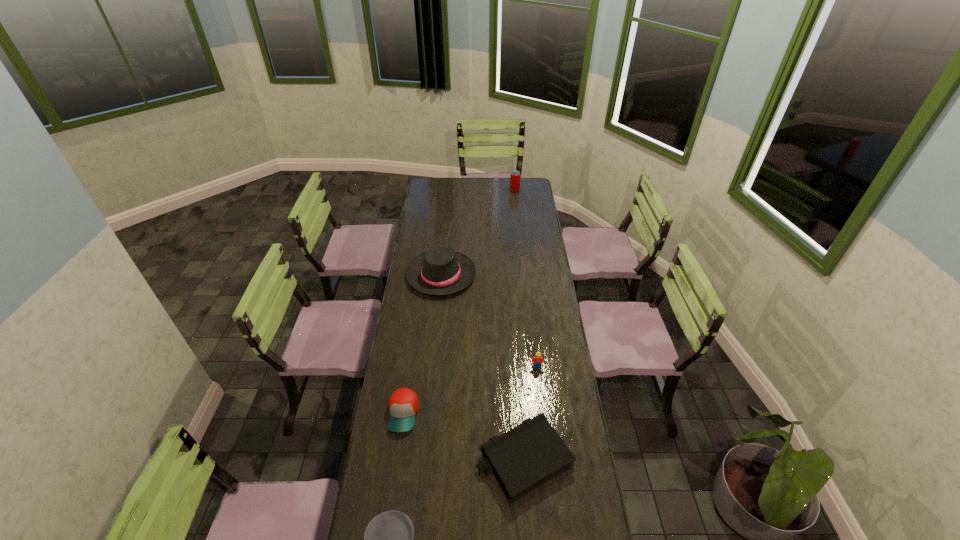
You are a GUI agent. You are given a task and a screenshot of the screen. Output one action in this format:
    pyautogui.click(x=<x>, y=<y>)
    Task: Click on the free space at the right edge of the desktop
    
    Given the screenshot: What is the action you would take?
    pyautogui.click(x=533, y=216)

This screenshot has height=540, width=960. I want to click on empty location between the Bible and the farthest object, so click(519, 325).

You are a GUI agent. You are given a task and a screenshot of the screen. Output one action in this format:
    pyautogui.click(x=<x>, y=<y>)
    Task: Click on the empty space that is in between the Bible and the Lego
    The image size is (960, 540).
    Given the screenshot: What is the action you would take?
    pyautogui.click(x=531, y=413)

Where is `free space that is in between the Bible and the dress hat`? free space that is in between the Bible and the dress hat is located at coordinates (483, 367).

This screenshot has width=960, height=540. Find the location of `vacant point located between the baseball cap and the Bible`. vacant point located between the baseball cap and the Bible is located at coordinates [464, 437].

Identify the location of free space between the second farthest object and the Bible. (483, 367).

Image resolution: width=960 pixels, height=540 pixels. What are the coordinates of `free space that is in between the dress hat and the Bible` in the screenshot? It's located at (483, 367).

This screenshot has height=540, width=960. I want to click on free space between the baseball cap and the farthest object, so click(x=459, y=302).

The height and width of the screenshot is (540, 960). Identify the location of object that is the fifth closest to the baseball cap. (515, 177).

Select which object appears as the third closest to the nearest object. Please provide its 2D coordinates. Your answer should be formatted as a tuple, i.e. [(x, y)], where the tuple contains the x and y coordinates of a point satisfying the conditions above.

[(537, 359)]